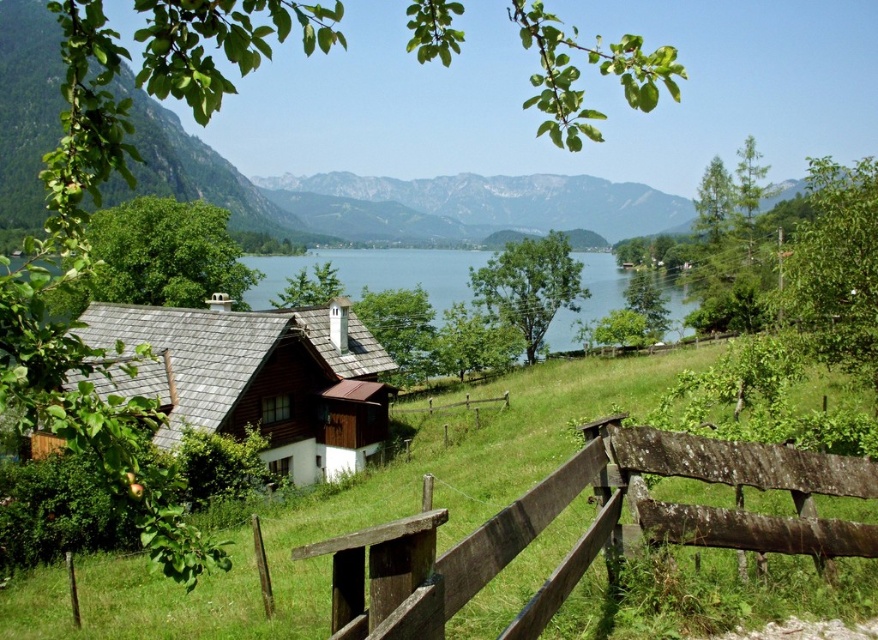
Question: Which of the following is the farthest from the observer?

Choices:
 (A) (596, 275)
 (B) (282, 516)

Answer: (A)

Question: Which point is closer to the camera?

Choices:
 (A) blue water at center
 (B) white wooden hut at center
 (C) weathered wood fence at lower right
 (D) green grassy at lower center

Answer: (D)

Question: Which is farther from the weathered wood fence at lower right?

Choices:
 (A) green grassy at lower center
 (B) white wooden hut at center
 (C) blue water at center

Answer: (C)

Question: Can you confirm if weathered wood fence at lower right is positioned below white wooden hut at center?

Choices:
 (A) yes
 (B) no

Answer: (B)

Question: Can you confirm if weathered wood fence at lower right is positioned below blue water at center?

Choices:
 (A) no
 (B) yes

Answer: (B)

Question: Considering the relative positions of white wooden hut at center and blue water at center in the image provided, where is white wooden hut at center located with respect to blue water at center?

Choices:
 (A) right
 (B) left

Answer: (B)